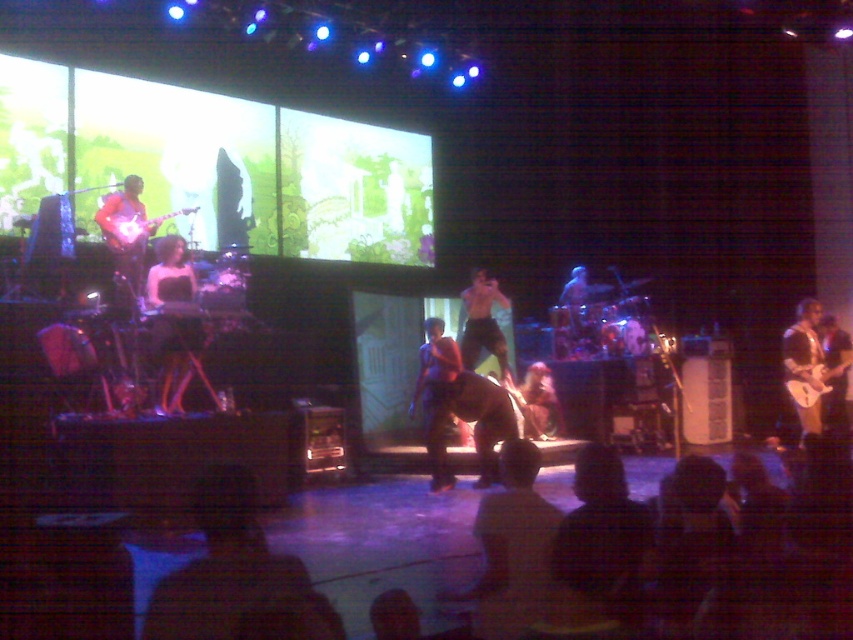
Question: Among these points, which one is farthest from the camera?

Choices:
 (A) (115, 256)
 (B) (807, 420)
 (C) (463, 356)

Answer: (C)

Question: Is dark purple shirt at center positioned before glossy brown guitar at right?

Choices:
 (A) yes
 (B) no

Answer: (A)

Question: Is matte black dress at center in front of shiny black shorts at center?

Choices:
 (A) yes
 (B) no

Answer: (A)

Question: Which point is farther from the camera taking this photo?

Choices:
 (A) (444, 468)
 (B) (471, 285)
 (C) (795, 333)

Answer: (B)

Question: Which object is closer to the camera taking this photo?

Choices:
 (A) shiny black shorts at center
 (B) glossy brown guitar at right
 (C) matte black guitar at left
 (D) matte black dress at center

Answer: (D)

Question: Can you confirm if glossy brown guitar at right is positioned to the left of matte black guitar at left?

Choices:
 (A) yes
 (B) no

Answer: (B)